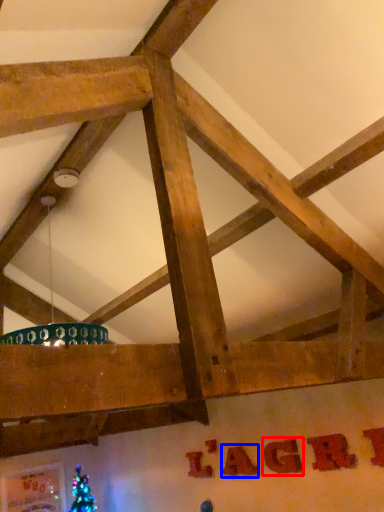
Question: Which point is further to the camera, letter (highlighted by a red box) or letter (highlighted by a blue box)?

Choices:
 (A) letter
 (B) letter

Answer: (B)